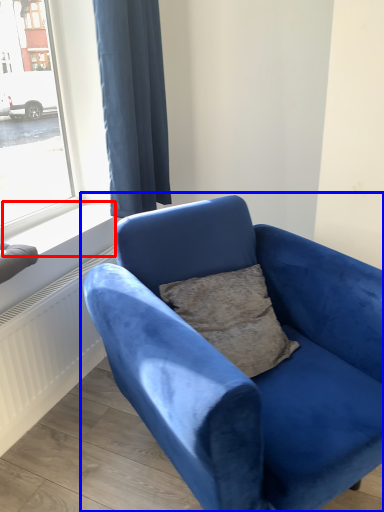
Question: Which object is further to the camera taking this photo, window sill (highlighted by a red box) or studio couch (highlighted by a blue box)?

Choices:
 (A) window sill
 (B) studio couch

Answer: (A)